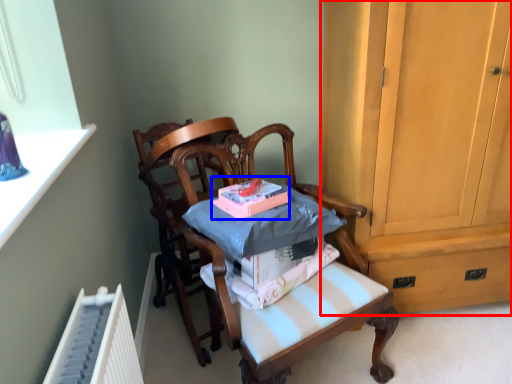
Question: Which object is closer to the camera taking this photo, cabinetry (highlighted by a red box) or book (highlighted by a blue box)?

Choices:
 (A) cabinetry
 (B) book

Answer: (A)